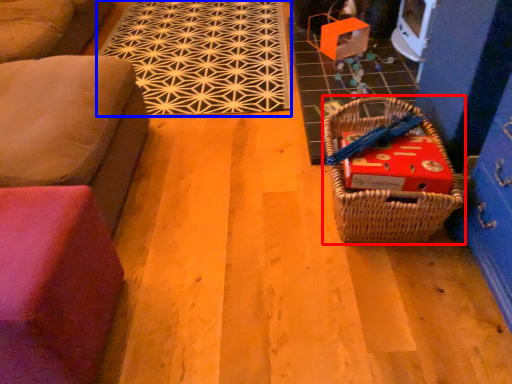
Question: Which object appears farthest to the camera in this image, picnic basket (highlighted by a red box) or mat (highlighted by a blue box)?

Choices:
 (A) picnic basket
 (B) mat

Answer: (B)